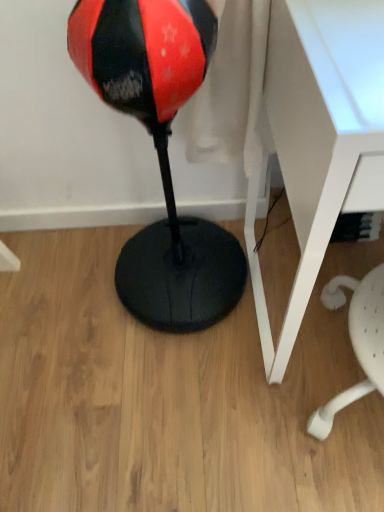
The image size is (384, 512). I want to click on red/black glossy bean bag at center, so click(x=160, y=153).

Measure the distance between point (117, 53) and camera.

The depth of point (117, 53) is 58.80 centimeters.

This screenshot has width=384, height=512. What do you see at coordinates (160, 153) in the screenshot?
I see `red/black glossy bean bag at center` at bounding box center [160, 153].

You are a GUI agent. You are given a task and a screenshot of the screen. Output one action in this format:
    pyautogui.click(x=<x>, y=<y>)
    Task: Click on the white plastic table at right
    This screenshot has height=512, width=384.
    Given the screenshot: What is the action you would take?
    pyautogui.click(x=319, y=137)

What do you see at coordinates (319, 137) in the screenshot? I see `white plastic table at right` at bounding box center [319, 137].

Where is `red/black glossy bean bag at center`? The image size is (384, 512). red/black glossy bean bag at center is located at coordinates (160, 153).

Can you confirm if red/black glossy bean bag at center is positioned to the right of white plastic table at right?

Incorrect, red/black glossy bean bag at center is not on the right side of white plastic table at right.

Does red/black glossy bean bag at center lie in front of white plastic table at right?

No, the depth of red/black glossy bean bag at center is greater than that of white plastic table at right.

Which is behind, point (141, 267) or point (310, 129)?

The point (141, 267) is behind.

Looking at this image, from the image's perspective, would you say red/black glossy bean bag at center is positioned over white plastic table at right?

Correct, red/black glossy bean bag at center appears higher than white plastic table at right in the image.

From a real-world perspective, who is located higher, red/black glossy bean bag at center or white plastic table at right?

red/black glossy bean bag at center is physically above.

Based on the photo, which of these two, red/black glossy bean bag at center or white plastic table at right, is thinner?

red/black glossy bean bag at center is thinner.

Is red/black glossy bean bag at center taller than white plastic table at right?

Yes.

Consider the image. Who is bigger, red/black glossy bean bag at center or white plastic table at right?

white plastic table at right is bigger.

Would you say red/black glossy bean bag at center is inside or outside white plastic table at right?

red/black glossy bean bag at center is not inside white plastic table at right, it's outside.

Can you see red/black glossy bean bag at center touching white plastic table at right?

No, red/black glossy bean bag at center is not making contact with white plastic table at right.

Is red/black glossy bean bag at center turned away from white plastic table at right?

No, white plastic table at right is not at the back of red/black glossy bean bag at center.

The width and height of the screenshot is (384, 512). In order to click on table that is below the red/black glossy bean bag at center (from the image's perspective) in this screenshot , I will do `click(319, 137)`.

Which is more to the left, white plastic table at right or red/black glossy bean bag at center?

red/black glossy bean bag at center.

Based on the photo, is white plastic table at right positioned before red/black glossy bean bag at center?

Yes, it is.

Is point (343, 48) closer or farther from the camera than point (164, 328)?

Point (343, 48) is closer to the camera than point (164, 328).

Consider the image. From the image's perspective, is white plastic table at right under red/black glossy bean bag at center?

Indeed, from the image's perspective, white plastic table at right is shown beneath red/black glossy bean bag at center.

From a real-world perspective, is white plastic table at right positioned above or below red/black glossy bean bag at center?

white plastic table at right is situated lower than red/black glossy bean bag at center in the real world.

Which of these two, white plastic table at right or red/black glossy bean bag at center, is thinner?

Thinner between the two is red/black glossy bean bag at center.

Which of these two, white plastic table at right or red/black glossy bean bag at center, stands shorter?

white plastic table at right.

Considering the sizes of white plastic table at right and red/black glossy bean bag at center in the image, is white plastic table at right bigger or smaller than red/black glossy bean bag at center?

Considering their sizes, white plastic table at right takes up more space than red/black glossy bean bag at center.

Is white plastic table at right not inside red/black glossy bean bag at center?

Yes, white plastic table at right is located beyond the bounds of red/black glossy bean bag at center.

Is there a large distance between white plastic table at right and red/black glossy bean bag at center?

No, white plastic table at right is not far from red/black glossy bean bag at center.

Is white plastic table at right facing towards red/black glossy bean bag at center?

No, white plastic table at right is not oriented towards red/black glossy bean bag at center.

How distant is white plastic table at right from red/black glossy bean bag at center?

white plastic table at right is 15.47 inches away from red/black glossy bean bag at center.

Locate an element on the screen. The image size is (384, 512). table below the red/black glossy bean bag at center (from a real-world perspective) is located at coordinates (319, 137).

Locate an element on the screen. bean bag chair that is on the left side of white plastic table at right is located at coordinates click(x=160, y=153).

Identify the location of table that is below the red/black glossy bean bag at center (from the image's perspective). This screenshot has height=512, width=384. (319, 137).